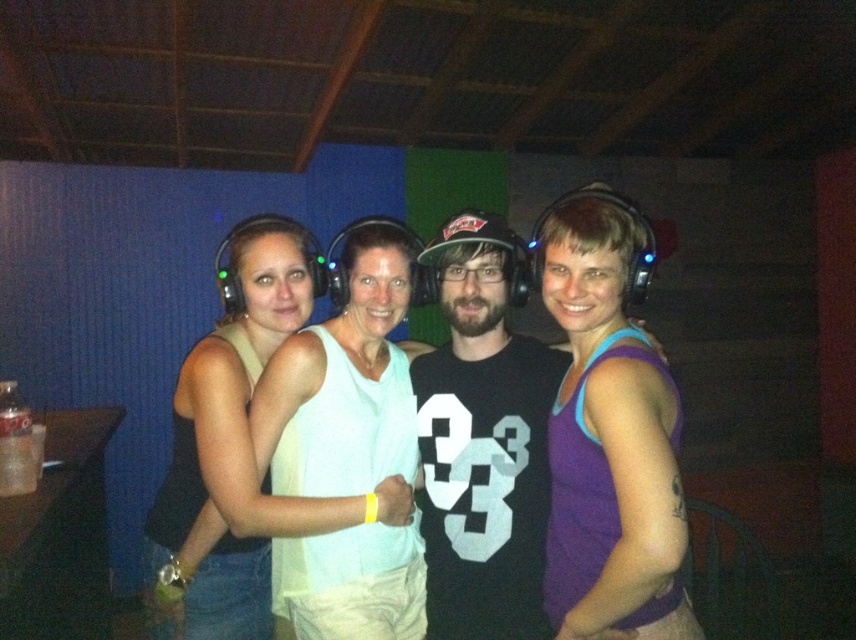
Which is behind, point (455, 340) or point (242, 560)?

Point (242, 560)

Is black matte t-shirt at center shorter than matte white tank top at center?

Correct, black matte t-shirt at center is not as tall as matte white tank top at center.

Is point (509, 632) positioned behind point (223, 392)?

No.

Where is `black matte t-shirt at center`? This screenshot has width=856, height=640. black matte t-shirt at center is located at coordinates (483, 442).

Who is shorter, purple matte tank top at center or matte white tank top at center?

purple matte tank top at center is shorter.

Describe the element at coordinates (609, 435) in the screenshot. I see `purple matte tank top at center` at that location.

Does point (569, 486) come closer to viewer compared to point (259, 314)?

That is True.

Identify the location of purple matte tank top at center. Image resolution: width=856 pixels, height=640 pixels. (609, 435).

In the scene shown: Who is more forward, [637,486] or [428,465]?

Point [637,486]

Can you confirm if purple matte tank top at center is smaller than black matte t-shirt at center?

Incorrect, purple matte tank top at center is not smaller in size than black matte t-shirt at center.

I want to click on purple matte tank top at center, so click(x=609, y=435).